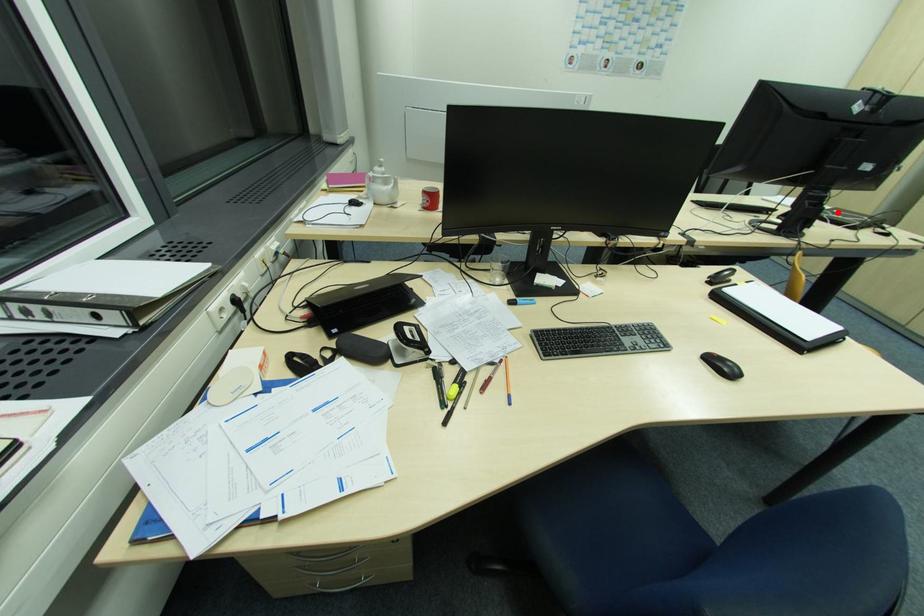
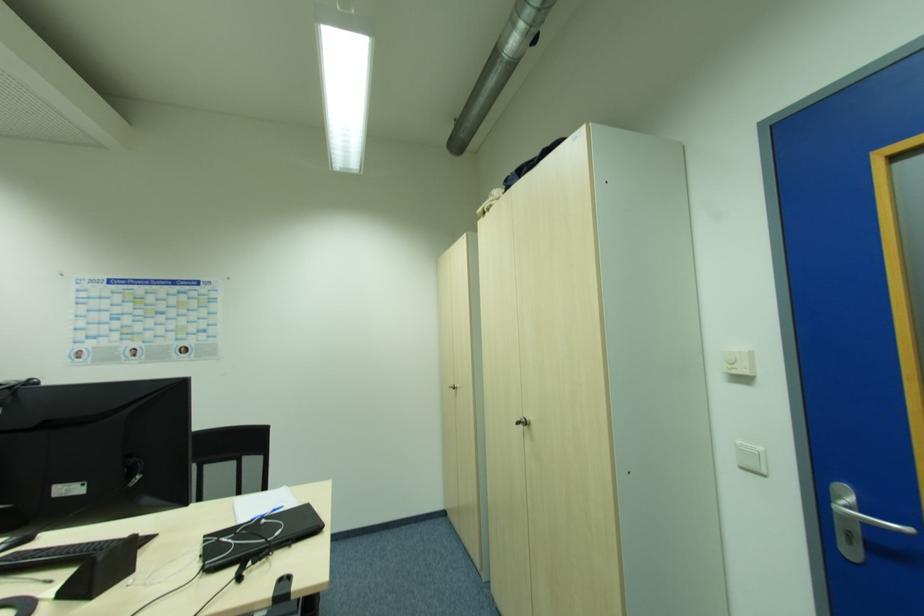
Where in the second image is the point corresponding to the highlighted location from the first image?

(265, 521)